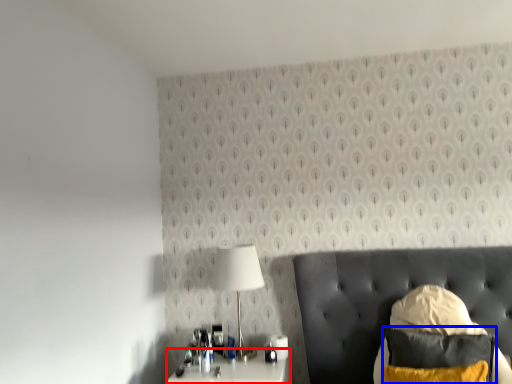
Question: Which object is closer to the camera taking this photo, nightstand (highlighted by a red box) or pillow (highlighted by a blue box)?

Choices:
 (A) nightstand
 (B) pillow

Answer: (B)